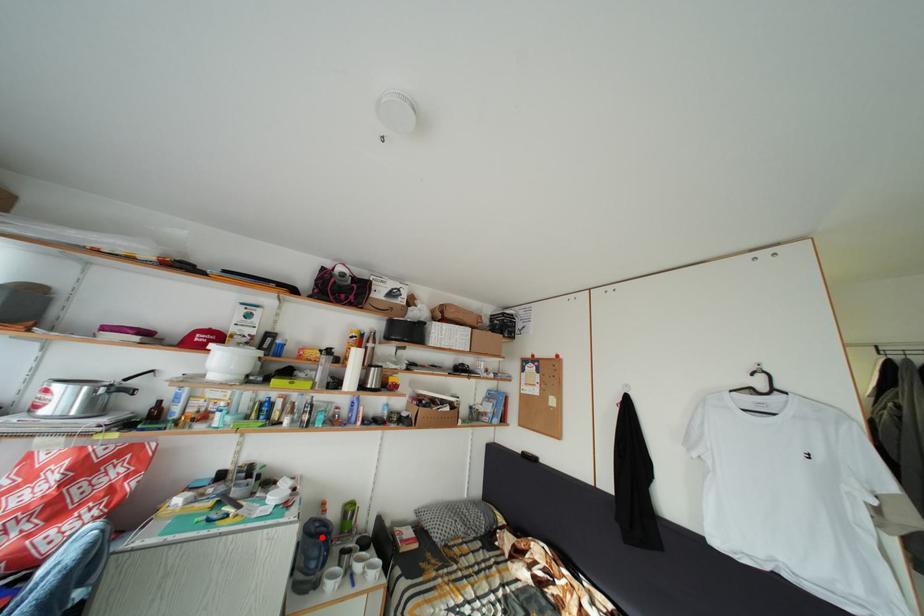
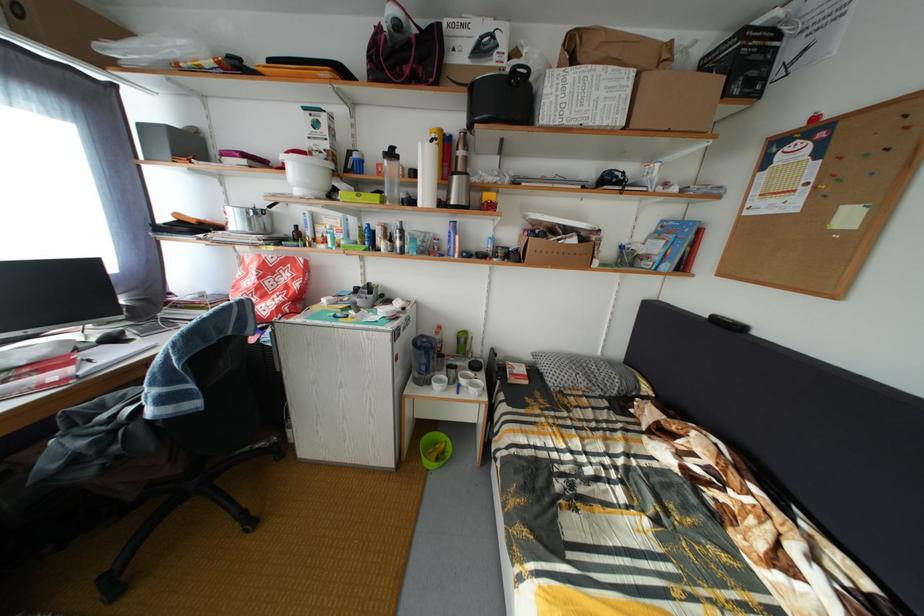
Find the pixel in the second image that matches the highlighted location in the first image.

(428, 350)